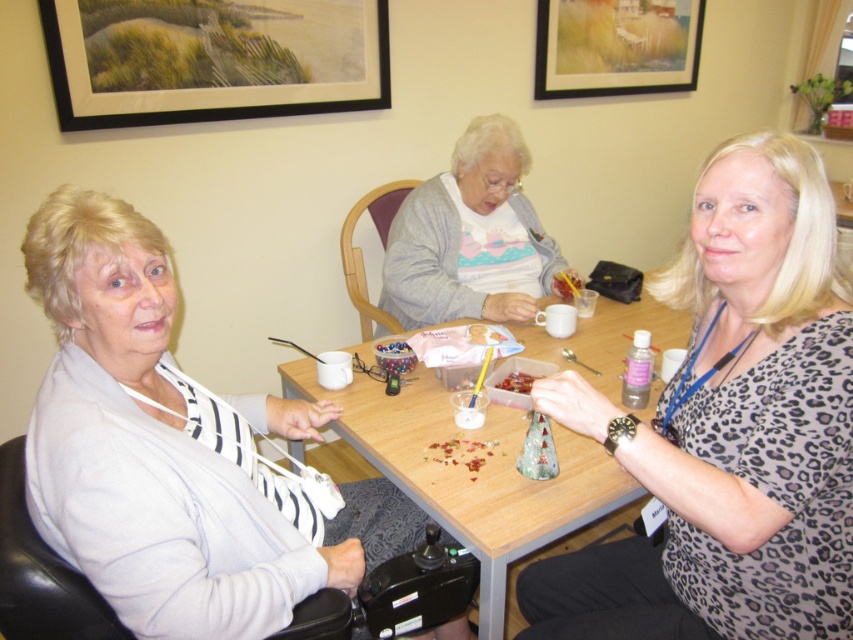
Between light gray sweater at left and wooden table at center, which one has less height?

wooden table at center

Identify the location of light gray sweater at left. (x=173, y=451).

Which is above, light gray sweater at left or black framed picture at upper left?

black framed picture at upper left

Can you confirm if light gray sweater at left is positioned to the left of black framed picture at upper left?

In fact, light gray sweater at left is to the right of black framed picture at upper left.

Is point (102, 321) less distant than point (149, 49)?

Yes.

Locate an element on the screen. light gray sweater at left is located at coordinates (173, 451).

Is the position of black framed picture at upper left less distant than that of matte gold picture frame at upper center?

Yes, it is.

Does black framed picture at upper left have a greater height compared to matte gold picture frame at upper center?

Incorrect, black framed picture at upper left's height is not larger of matte gold picture frame at upper center's.

Who is more distant from viewer, (270,6) or (540,33)?

Positioned behind is point (540,33).

Locate an element on the screen. This screenshot has height=640, width=853. black framed picture at upper left is located at coordinates (212, 58).